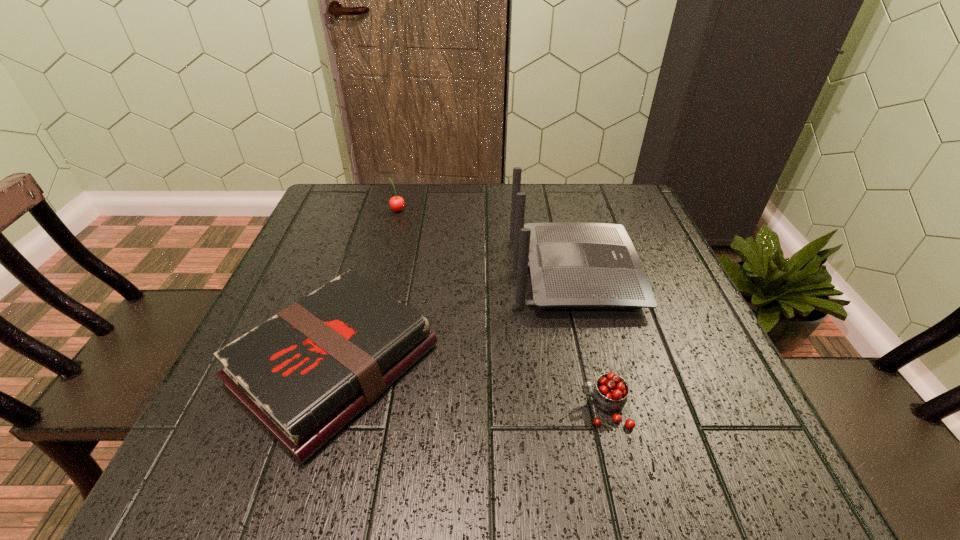
The image size is (960, 540). What are the coordinates of `vacant area at the far right corner` in the screenshot? It's located at (594, 197).

Image resolution: width=960 pixels, height=540 pixels. Find the location of `vacant space at the near right corner`. vacant space at the near right corner is located at coordinates (668, 447).

Where is `free space between the router and the hardback book`? The width and height of the screenshot is (960, 540). free space between the router and the hardback book is located at coordinates (454, 319).

This screenshot has width=960, height=540. Identify the location of empty location between the tallest object and the nearer cherry. (589, 340).

Locate an element on the screen. The image size is (960, 540). free spot between the nearer cherry and the router is located at coordinates (589, 340).

Locate an element on the screen. This screenshot has height=540, width=960. free space that is in between the nearer cherry and the hardback book is located at coordinates (470, 387).

Find the location of a particular element. The height and width of the screenshot is (540, 960). free space between the left cherry and the right cherry is located at coordinates (501, 309).

At what (x,y) coordinates should I click in order to perform the action: click on free space that is in between the left cherry and the tallest object. Please return your answer as a coordinate pair (x, y). The width and height of the screenshot is (960, 540). Looking at the image, I should click on (486, 241).

I want to click on vacant space that's between the tallest object and the hardback book, so click(x=454, y=319).

I want to click on vacant space that is in between the router and the hardback book, so click(454, 319).